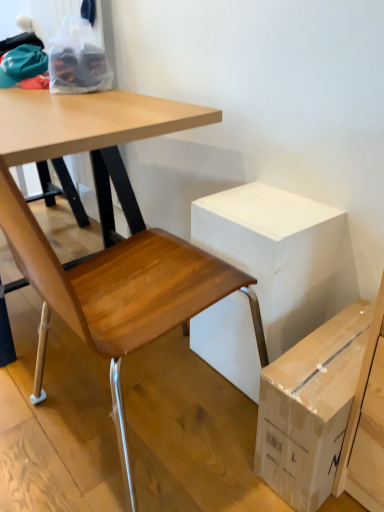
The image size is (384, 512). Find the location of `empty space that is in between brown cardboard box at lower right and white cardboard box at center`. empty space that is in between brown cardboard box at lower right and white cardboard box at center is located at coordinates (220, 409).